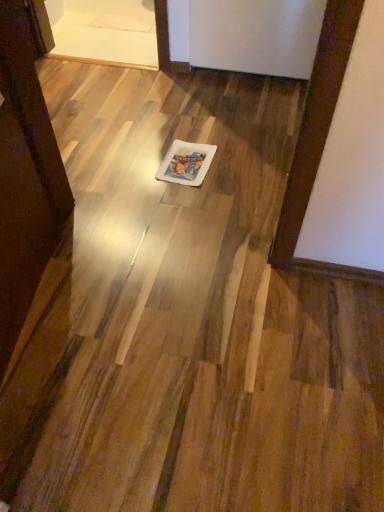
The height and width of the screenshot is (512, 384). I want to click on free space above white glossy square plate at center (from a real-world perspective), so click(x=186, y=156).